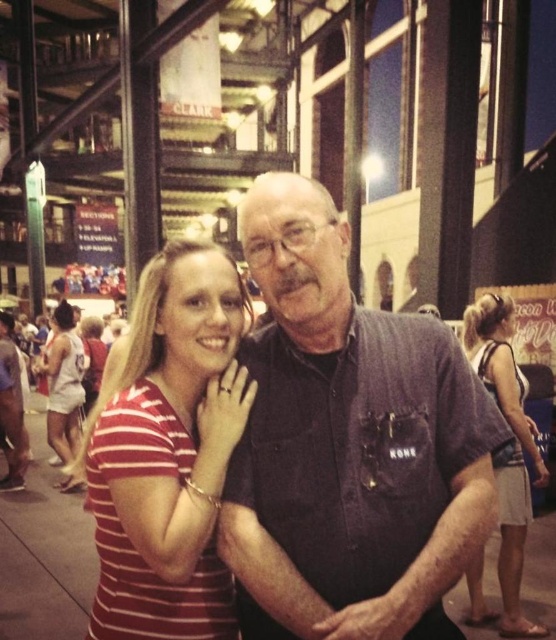
Question: Which point appears farthest from the camera in this image?

Choices:
 (A) coord(208,388)
 (B) coord(492,376)

Answer: (B)

Question: Does striped cotton shirt at center have a greater width compared to white jersey at left?

Choices:
 (A) yes
 (B) no

Answer: (A)

Question: Which point is farther from the camera taking this photo?

Choices:
 (A) (329, 230)
 (B) (71, 340)
 (C) (142, 292)

Answer: (B)

Question: Can you confirm if dark blue shirt at center is positioned to the left of light brown textured shorts at lower right?

Choices:
 (A) yes
 (B) no

Answer: (A)

Question: Does striped cotton shirt at center appear under light brown textured shorts at lower right?

Choices:
 (A) yes
 (B) no

Answer: (B)

Question: Which object is positioned closest to the white jersey at left?

Choices:
 (A) light brown textured shorts at lower right
 (B) striped cotton shirt at center

Answer: (A)